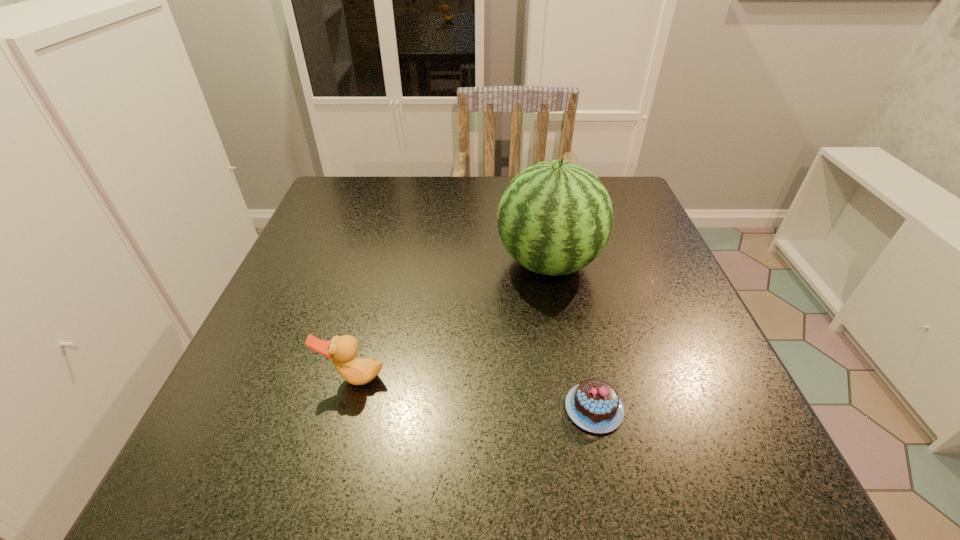
Identify the location of unoccupied position between the shortest object and the duck. Image resolution: width=960 pixels, height=540 pixels. (473, 393).

Where is `empty space between the chocolate cake and the duck`? empty space between the chocolate cake and the duck is located at coordinates (473, 393).

Where is `vacant space that's between the tallest object and the shortest object`? vacant space that's between the tallest object and the shortest object is located at coordinates (571, 336).

Where is `empty space between the chocolate cake and the tallest object`? This screenshot has width=960, height=540. empty space between the chocolate cake and the tallest object is located at coordinates (571, 336).

I want to click on free space that is in between the second shortest object and the watermelon, so click(451, 320).

Find the location of a particular element. vacant area between the shortest object and the watermelon is located at coordinates (571, 336).

Find the location of a particular element. This screenshot has height=540, width=960. object that is the second closest to the chocolate cake is located at coordinates (342, 350).

In order to click on object that is the closest one to the watermelon in this screenshot , I will do `click(594, 405)`.

Where is `free space that satisfies the following two spatial constraints: 1. on the beak of the shortest object; 2. on the left side of the leftmost object`? This screenshot has height=540, width=960. free space that satisfies the following two spatial constraints: 1. on the beak of the shortest object; 2. on the left side of the leftmost object is located at coordinates (346, 408).